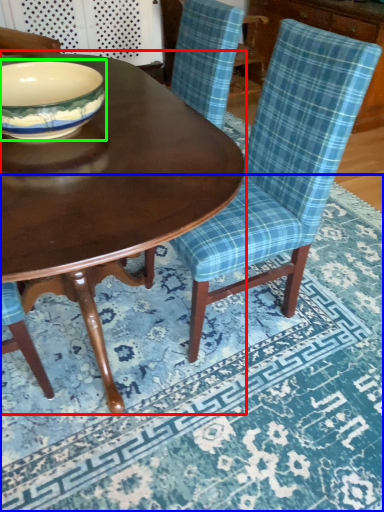
Question: Which object is the farthest from coffee table (highlighted by a red box)? Choose among these: place mat (highlighted by a blue box) or bowl (highlighted by a green box).

Choices:
 (A) place mat
 (B) bowl

Answer: (A)